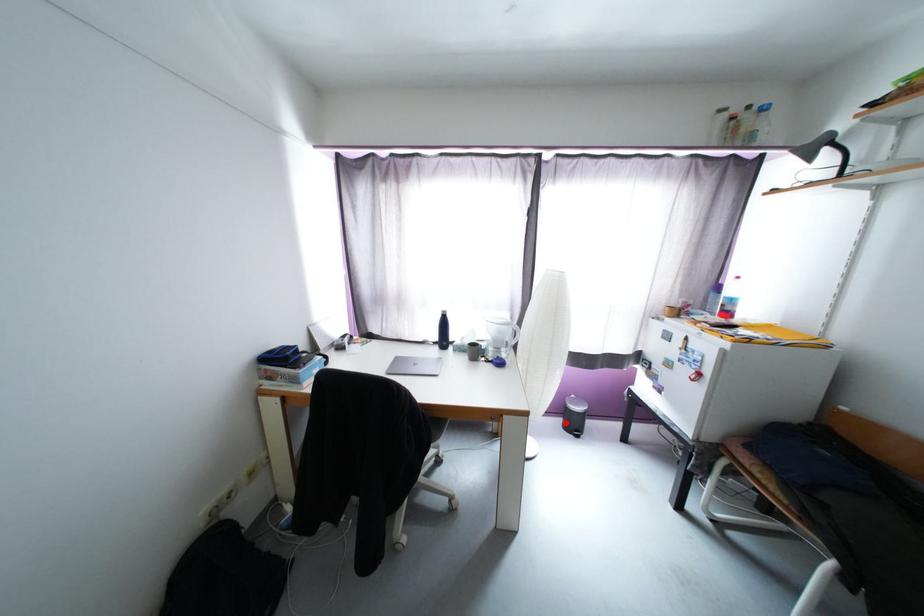
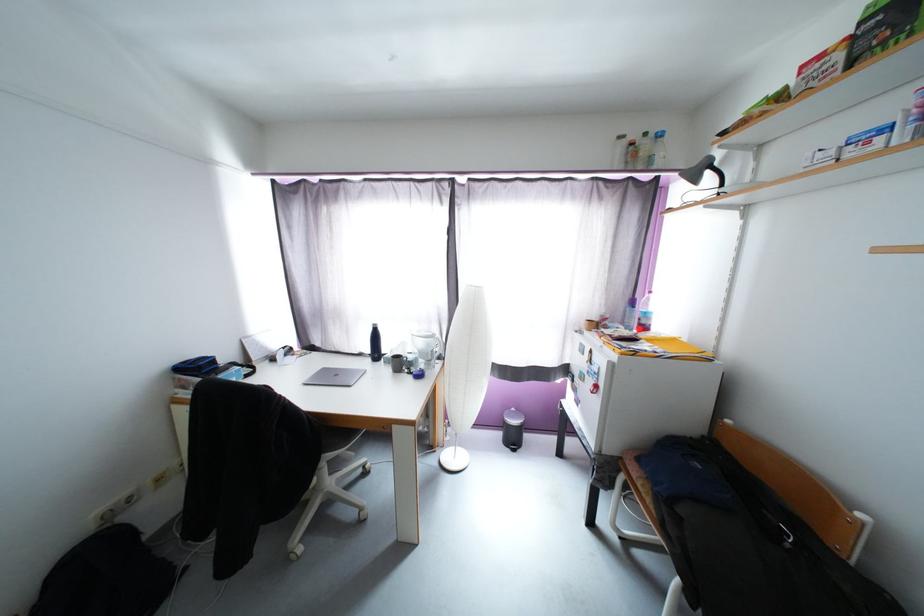
Question: I am providing you with two images of the same scene from different viewpoints. In image1, a red point is highlighted. Considering the same 3D point in image2, which of the following is correct?

Choices:
 (A) It is closer
 (B) It is farther

Answer: (B)